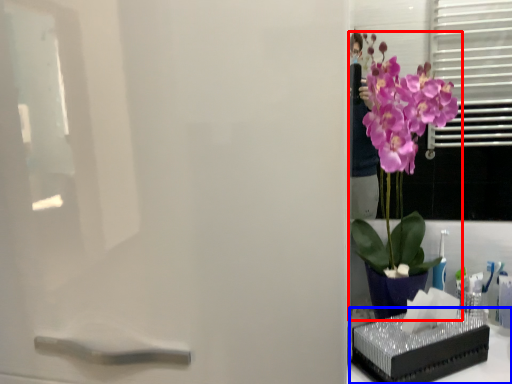
Question: Which object appears closest to the camera in this image, houseplant (highlighted by a red box) or window sill (highlighted by a blue box)?

Choices:
 (A) houseplant
 (B) window sill

Answer: (A)